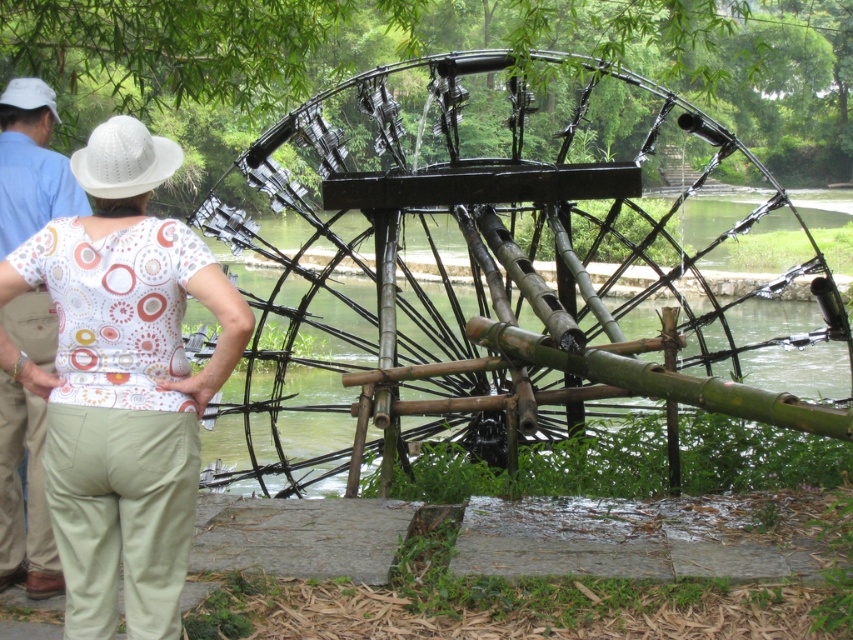
Question: Which point appears closest to the camera in this image?

Choices:
 (A) (1, 113)
 (B) (115, 330)
 (C) (347, 164)

Answer: (B)

Question: Is black bamboo waterwheel at center above white printed blouse at upper left?

Choices:
 (A) no
 (B) yes

Answer: (B)

Question: Does white printed blouse at upper left appear on the right side of blue cotton shirt at upper left?

Choices:
 (A) yes
 (B) no

Answer: (A)

Question: Is black bamboo waterwheel at center to the right of blue cotton shirt at upper left from the viewer's perspective?

Choices:
 (A) yes
 (B) no

Answer: (A)

Question: Which object appears farthest from the camera in this image?

Choices:
 (A) blue cotton shirt at upper left
 (B) black bamboo waterwheel at center
 (C) white printed blouse at upper left

Answer: (A)

Question: Estimate the real-world distances between objects in this image. Which object is closer to the black bamboo waterwheel at center?

Choices:
 (A) white printed blouse at upper left
 (B) blue cotton shirt at upper left

Answer: (A)